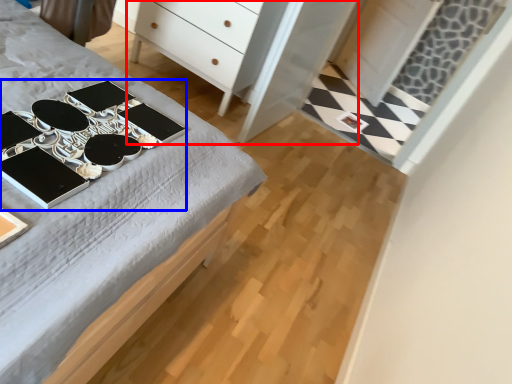
Question: Which point is further to the camera, dresser (highlighted by a red box) or changing table (highlighted by a blue box)?

Choices:
 (A) dresser
 (B) changing table

Answer: (A)